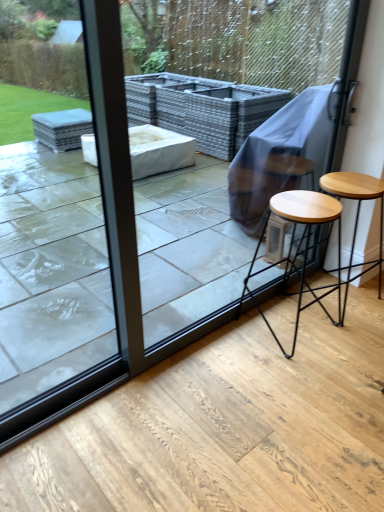
What are the coordinates of `light brown wood stool at lower right, the 2th stool from the right` in the screenshot? It's located at (300, 247).

Does light brown wood stool at lower right, the 2th stool from the right, have a lesser height compared to light brown wood stool at right, marked as the 1th stool in a right-to-left arrangement?

No, light brown wood stool at lower right, the 2th stool from the right, is not shorter than light brown wood stool at right, marked as the 1th stool in a right-to-left arrangement.

From the picture: From the image's perspective, which object appears higher, light brown wood stool at lower right, the 2th stool from the right, or light brown wood stool at right, the 2th stool positioned from the left?

light brown wood stool at right, the 2th stool positioned from the left, from the image's perspective.

Can you tell me how much light brown wood stool at lower right, the 1th stool when ordered from left to right, and light brown wood stool at right, the 2th stool positioned from the left, differ in facing direction?

The angular difference between light brown wood stool at lower right, the 1th stool when ordered from left to right, and light brown wood stool at right, the 2th stool positioned from the left, is 1.26 degrees.

Locate an element on the screen. The height and width of the screenshot is (512, 384). stool on the right of light brown wood stool at lower right, the 1th stool when ordered from left to right is located at coordinates tap(356, 214).

The image size is (384, 512). I want to click on stool that appears on the left of light brown wood stool at right, the 2th stool positioned from the left, so click(300, 247).

Between light brown wood stool at right, marked as the 1th stool in a right-to-left arrangement, and light brown wood stool at lower right, the 1th stool when ordered from left to right, which one is positioned in front?

light brown wood stool at lower right, the 1th stool when ordered from left to right, is closer to the camera.

Would you say light brown wood stool at lower right, the 2th stool from the right, is part of light brown wood stool at right, marked as the 1th stool in a right-to-left arrangement,'s contents?

Actually, light brown wood stool at lower right, the 2th stool from the right, is outside light brown wood stool at right, marked as the 1th stool in a right-to-left arrangement.

Does light brown wood stool at right, marked as the 1th stool in a right-to-left arrangement, have a lesser width compared to light brown wood stool at lower right, the 1th stool when ordered from left to right?

No, light brown wood stool at right, marked as the 1th stool in a right-to-left arrangement, is not thinner than light brown wood stool at lower right, the 1th stool when ordered from left to right.

Which object is further away from the camera, light brown wood stool at right, the 2th stool positioned from the left, or transparent glass screen door at upper center?

light brown wood stool at right, the 2th stool positioned from the left, is behind.

From the image's perspective, is light brown wood stool at right, the 2th stool positioned from the left, beneath transparent glass screen door at upper center?

Yes, from the image's perspective, light brown wood stool at right, the 2th stool positioned from the left, is below transparent glass screen door at upper center.

Does light brown wood stool at right, marked as the 1th stool in a right-to-left arrangement, turn towards transparent glass screen door at upper center?

No, light brown wood stool at right, marked as the 1th stool in a right-to-left arrangement, is not aimed at transparent glass screen door at upper center.

Is light brown wood stool at right, marked as the 1th stool in a right-to-left arrangement, not inside transparent glass screen door at upper center?

Yes, light brown wood stool at right, marked as the 1th stool in a right-to-left arrangement, is located beyond the bounds of transparent glass screen door at upper center.

Between transparent glass screen door at upper center and light brown wood stool at lower right, the 2th stool from the right, which one has smaller width?

Thinner between the two is transparent glass screen door at upper center.

Considering the relative positions of transparent glass screen door at upper center and light brown wood stool at lower right, the 1th stool when ordered from left to right, in the image provided, is transparent glass screen door at upper center to the right of light brown wood stool at lower right, the 1th stool when ordered from left to right, from the viewer's perspective?

In fact, transparent glass screen door at upper center is to the left of light brown wood stool at lower right, the 1th stool when ordered from left to right.

How distant is transparent glass screen door at upper center from light brown wood stool at lower right, the 2th stool from the right?

They are 4.03 meters apart.

From the image's perspective, is transparent glass screen door at upper center under light brown wood stool at lower right, the 2th stool from the right?

No, from the image's perspective, transparent glass screen door at upper center is not beneath light brown wood stool at lower right, the 2th stool from the right.

The image size is (384, 512). I want to click on stool above the transparent glass door at upper left (from the image's perspective), so click(x=356, y=214).

Is the surface of light brown wood stool at right, marked as the 1th stool in a right-to-left arrangement, in direct contact with transparent glass door at upper left?

They are not placed beside each other.

Is light brown wood stool at right, marked as the 1th stool in a right-to-left arrangement, looking in the opposite direction of transparent glass door at upper left?

No, transparent glass door at upper left is not at the back of light brown wood stool at right, marked as the 1th stool in a right-to-left arrangement.

Which is in front, point (382, 242) or point (45, 293)?

The point (382, 242) is closer.

From a real-world perspective, between transparent glass screen door at upper center and light brown wood stool at right, marked as the 1th stool in a right-to-left arrangement, who is vertically higher?

transparent glass screen door at upper center is physically above.

Is transparent glass screen door at upper center oriented towards light brown wood stool at right, marked as the 1th stool in a right-to-left arrangement?

Yes, transparent glass screen door at upper center is oriented towards light brown wood stool at right, marked as the 1th stool in a right-to-left arrangement.

What's the angular difference between transparent glass screen door at upper center and light brown wood stool at right, marked as the 1th stool in a right-to-left arrangement,'s facing directions?

transparent glass screen door at upper center and light brown wood stool at right, marked as the 1th stool in a right-to-left arrangement, are facing 2.26 degrees away from each other.

Which object is positioned more to the right, transparent glass door at upper left or light brown wood stool at lower right, the 1th stool when ordered from left to right?

From the viewer's perspective, light brown wood stool at lower right, the 1th stool when ordered from left to right, appears more on the right side.

Does point (60, 218) come in front of point (307, 290)?

No.

Is transparent glass door at upper left located outside light brown wood stool at lower right, the 2th stool from the right?

Indeed, transparent glass door at upper left is completely outside light brown wood stool at lower right, the 2th stool from the right.

Is transparent glass door at upper left wider than light brown wood stool at lower right, the 1th stool when ordered from left to right?

Incorrect, the width of transparent glass door at upper left does not surpass that of light brown wood stool at lower right, the 1th stool when ordered from left to right.

Image resolution: width=384 pixels, height=512 pixels. Find the location of `stool that appears on the right of light brown wood stool at lower right, the 1th stool when ordered from left to right`. stool that appears on the right of light brown wood stool at lower right, the 1th stool when ordered from left to right is located at coordinates (356, 214).

Locate an element on the screen. The width and height of the screenshot is (384, 512). stool on the left of light brown wood stool at right, marked as the 1th stool in a right-to-left arrangement is located at coordinates (300, 247).

Based on their spatial positions, is light brown wood stool at right, the 2th stool positioned from the left, or light brown wood stool at lower right, the 1th stool when ordered from left to right, further from transparent glass door at upper left?

light brown wood stool at right, the 2th stool positioned from the left, is positioned further to the anchor transparent glass door at upper left.

Which object lies nearer to the anchor point transparent glass screen door at upper center, light brown wood stool at right, marked as the 1th stool in a right-to-left arrangement, or light brown wood stool at lower right, the 2th stool from the right?

The object closer to transparent glass screen door at upper center is light brown wood stool at right, marked as the 1th stool in a right-to-left arrangement.

Looking at the image, which one is located closer to light brown wood stool at right, the 2th stool positioned from the left, transparent glass door at upper left or light brown wood stool at lower right, the 1th stool when ordered from left to right?

light brown wood stool at lower right, the 1th stool when ordered from left to right.

Estimate the real-world distances between objects in this image. Which object is further from light brown wood stool at right, marked as the 1th stool in a right-to-left arrangement, light brown wood stool at lower right, the 2th stool from the right, or transparent glass screen door at upper center?

Based on the image, transparent glass screen door at upper center appears to be further to light brown wood stool at right, marked as the 1th stool in a right-to-left arrangement.

Based on their spatial positions, is transparent glass door at upper left or transparent glass screen door at upper center closer to light brown wood stool at right, the 2th stool positioned from the left?

transparent glass door at upper left lies closer to light brown wood stool at right, the 2th stool positioned from the left, than the other object.

Estimate the real-world distances between objects in this image. Which object is further from transparent glass screen door at upper center, transparent glass door at upper left or light brown wood stool at right, marked as the 1th stool in a right-to-left arrangement?

transparent glass door at upper left lies further to transparent glass screen door at upper center than the other object.

Based on their spatial positions, is transparent glass screen door at upper center or light brown wood stool at right, marked as the 1th stool in a right-to-left arrangement, further from light brown wood stool at lower right, the 1th stool when ordered from left to right?

Among the two, transparent glass screen door at upper center is located further to light brown wood stool at lower right, the 1th stool when ordered from left to right.

When comparing their distances from transparent glass door at upper left, does transparent glass screen door at upper center or light brown wood stool at lower right, the 1th stool when ordered from left to right, seem further?

transparent glass screen door at upper center.

Where is `screen door situated between transparent glass door at upper left and light brown wood stool at lower right, the 2th stool from the right, from left to right`? screen door situated between transparent glass door at upper left and light brown wood stool at lower right, the 2th stool from the right, from left to right is located at coordinates (246, 66).

The height and width of the screenshot is (512, 384). I want to click on stool located between transparent glass screen door at upper center and light brown wood stool at right, marked as the 1th stool in a right-to-left arrangement, in the depth direction, so (300, 247).

Find the location of a particular element. The height and width of the screenshot is (512, 384). stool between transparent glass door at upper left and light brown wood stool at right, the 2th stool positioned from the left is located at coordinates (300, 247).

Image resolution: width=384 pixels, height=512 pixels. Identify the location of screen door situated between transparent glass door at upper left and light brown wood stool at right, marked as the 1th stool in a right-to-left arrangement, from left to right. (246, 66).